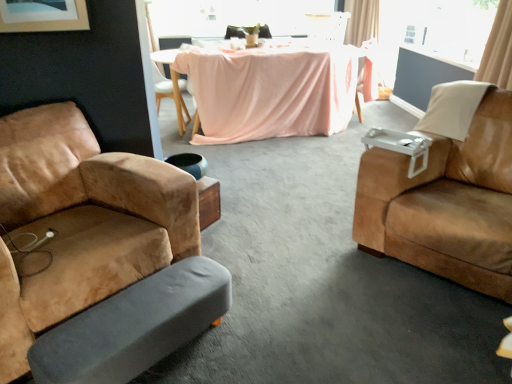
Question: Is beige fabric curtain at upper right, the 2th curtain from the top, bigger or smaller than white glossy armchair at upper center?

Choices:
 (A) big
 (B) small

Answer: (A)

Question: From the image's perspective, relative to white glossy armchair at upper center, is beige fabric curtain at upper right, the 1th curtain when ordered from bottom to top, above or below?

Choices:
 (A) below
 (B) above

Answer: (A)

Question: Estimate the real-world distances between objects in this image. Which object is closer to the transparent glass window at upper center?

Choices:
 (A) beige fabric curtain at upper right, the 1th curtain positioned from the top
 (B) white glossy armchair at upper center
 (C) pink fabric-covered table at center
 (D) beige fabric curtain at upper right, which is the 1th curtain in front-to-back order
 (E) matte pink fabric chair at center, arranged as the fourth chair when viewed from the front

Answer: (B)

Question: Which of these objects is positioned farthest from the suede brown couch at right, the 3th chair when ordered from left to right?

Choices:
 (A) suede tan armchair at left, arranged as the fourth chair when viewed from the back
 (B) white glossy armchair at upper center
 (C) matte pink fabric chair at center, which appears as the first chair when viewed from the right
 (D) white wood chair at upper center, which is the 4th chair in right-to-left order
 (E) transparent glass window at upper center

Answer: (E)